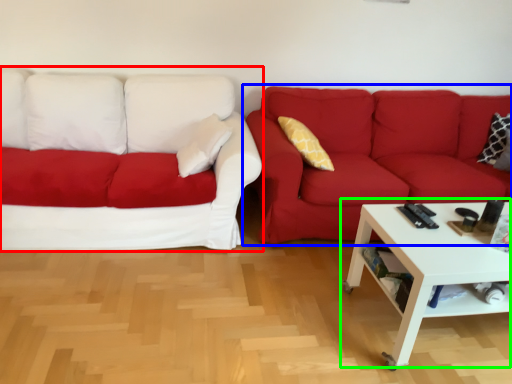
Question: Which object is positioned farthest from studio couch (highlighted by a red box)? Select from studio couch (highlighted by a blue box) and coffee table (highlighted by a green box).

Choices:
 (A) studio couch
 (B) coffee table

Answer: (B)